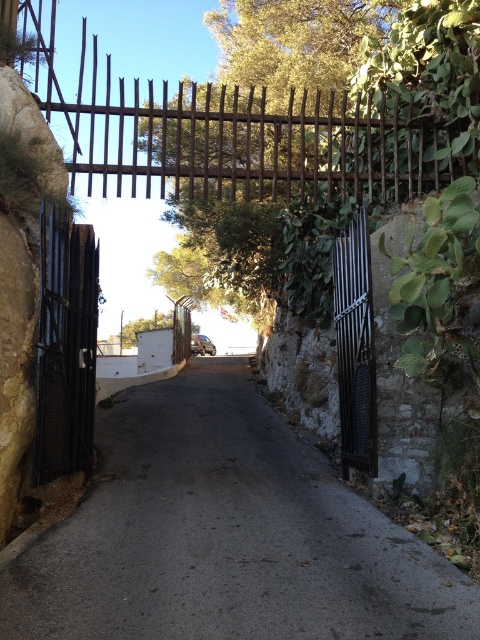
Is dark asphalt road at center taller than black metal gate at left?

In fact, dark asphalt road at center may be shorter than black metal gate at left.

Does dark asphalt road at center have a lesser width compared to black metal gate at left?

In fact, dark asphalt road at center might be wider than black metal gate at left.

Which is in front, point (183, 580) or point (48, 300)?

Point (183, 580) is in front.

At what (x,y) coordinates should I click in order to perform the action: click on dark asphalt road at center. Please return your answer as a coordinate pair (x, y). This screenshot has height=640, width=480. Looking at the image, I should click on (226, 536).

Is dark asphalt road at center shorter than rusty metal gate at upper center?

Yes, dark asphalt road at center is shorter than rusty metal gate at upper center.

Is point (143, 506) positioned behind point (95, 90)?

No, it is not.

Locate an element on the screen. dark asphalt road at center is located at coordinates (226, 536).

Is rusty metal gate at upper center thinner than black metal gate at left?

Incorrect, rusty metal gate at upper center's width is not less than black metal gate at left's.

Identify the location of rusty metal gate at upper center. (233, 132).